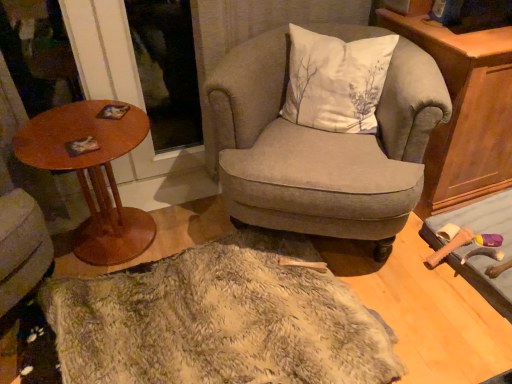
Question: Can you confirm if fuzzy beige rug at center is taller than textured gray armchair at center?

Choices:
 (A) no
 (B) yes

Answer: (A)

Question: Is fuzzy beige rug at center facing towards textured gray armchair at center?

Choices:
 (A) yes
 (B) no

Answer: (B)

Question: From the image's perspective, would you say fuzzy beige rug at center is positioned over textured gray armchair at center?

Choices:
 (A) no
 (B) yes

Answer: (A)

Question: Is fuzzy beige rug at center looking in the opposite direction of textured gray armchair at center?

Choices:
 (A) yes
 (B) no

Answer: (B)

Question: Are fuzzy beige rug at center and textured gray armchair at center far apart?

Choices:
 (A) yes
 (B) no

Answer: (B)

Question: Considering the relative positions of fuzzy beige rug at center and textured gray armchair at center in the image provided, is fuzzy beige rug at center to the left of textured gray armchair at center from the viewer's perspective?

Choices:
 (A) no
 (B) yes

Answer: (B)

Question: Considering the relative sizes of textured gray armchair at center and white cotton cushion at center in the image provided, is textured gray armchair at center thinner than white cotton cushion at center?

Choices:
 (A) no
 (B) yes

Answer: (A)

Question: Is textured gray armchair at center to the right of white cotton cushion at center from the viewer's perspective?

Choices:
 (A) yes
 (B) no

Answer: (B)

Question: Does textured gray armchair at center turn towards white cotton cushion at center?

Choices:
 (A) no
 (B) yes

Answer: (B)

Question: Considering the relative sizes of textured gray armchair at center and white cotton cushion at center in the image provided, is textured gray armchair at center bigger than white cotton cushion at center?

Choices:
 (A) yes
 (B) no

Answer: (A)

Question: Can you confirm if textured gray armchair at center is wider than white cotton cushion at center?

Choices:
 (A) no
 (B) yes

Answer: (B)

Question: Does textured gray armchair at center have a greater height compared to white cotton cushion at center?

Choices:
 (A) yes
 (B) no

Answer: (A)

Question: Considering the relative sizes of white cotton cushion at center and wooden cabinet at right in the image provided, is white cotton cushion at center wider than wooden cabinet at right?

Choices:
 (A) no
 (B) yes

Answer: (A)